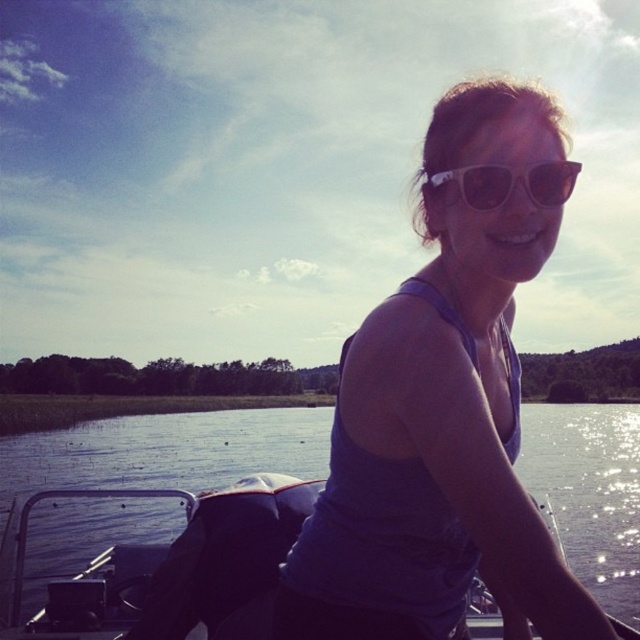
Does point (394, 561) come in front of point (561, 161)?

No, (394, 561) is behind (561, 161).

How much distance is there between purple fabric tank top at center and white plastic sunglasses at center?

purple fabric tank top at center and white plastic sunglasses at center are 32.60 centimeters apart from each other.

I want to click on purple fabric tank top at center, so click(x=435, y=452).

Where is `purple fabric tank top at center`? This screenshot has height=640, width=640. purple fabric tank top at center is located at coordinates 435,452.

Does transparent water at center have a larger size compared to white plastic sunglasses at center?

Yes.

Is transparent water at center thinner than white plastic sunglasses at center?

Result: Incorrect, transparent water at center's width is not less than white plastic sunglasses at center's.

Between point (145, 429) and point (468, 180), which one is positioned behind?

The point (145, 429) is behind.

Locate an element on the screen. transparent water at center is located at coordinates (164, 451).

Is point (477, 516) positioned behind point (307, 436)?

No, (477, 516) is in front of (307, 436).

Which is behind, point (340, 579) or point (593, 568)?

The point (593, 568) is more distant.

At what (x,y) coordinates should I click in order to perform the action: click on purple fabric tank top at center. Please return your answer as a coordinate pair (x, y). The height and width of the screenshot is (640, 640). Looking at the image, I should click on (435, 452).